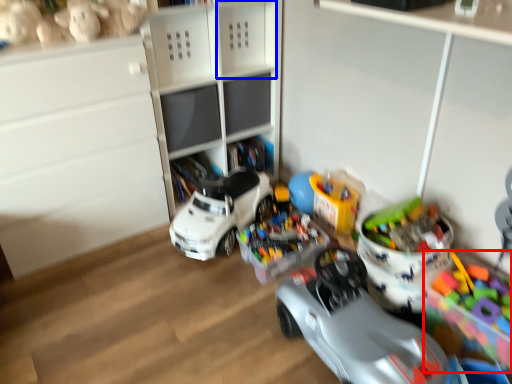
Question: Among these objects, which one is nearest to the camera, toy (highlighted by a red box) or shelf (highlighted by a blue box)?

Choices:
 (A) toy
 (B) shelf

Answer: (A)